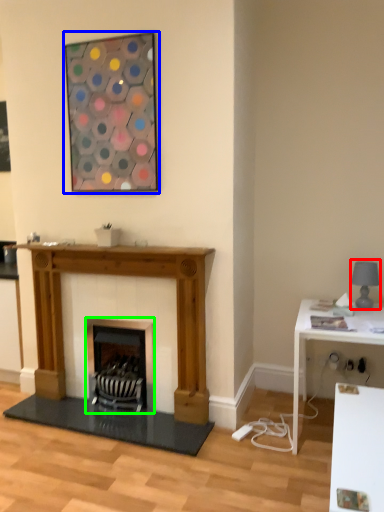
Question: Estimate the real-world distances between objects in this image. Which object is farther from lamp (highlighted by a red box), picture frame (highlighted by a blue box) or wood burning stove (highlighted by a green box)?

Choices:
 (A) picture frame
 (B) wood burning stove

Answer: (A)